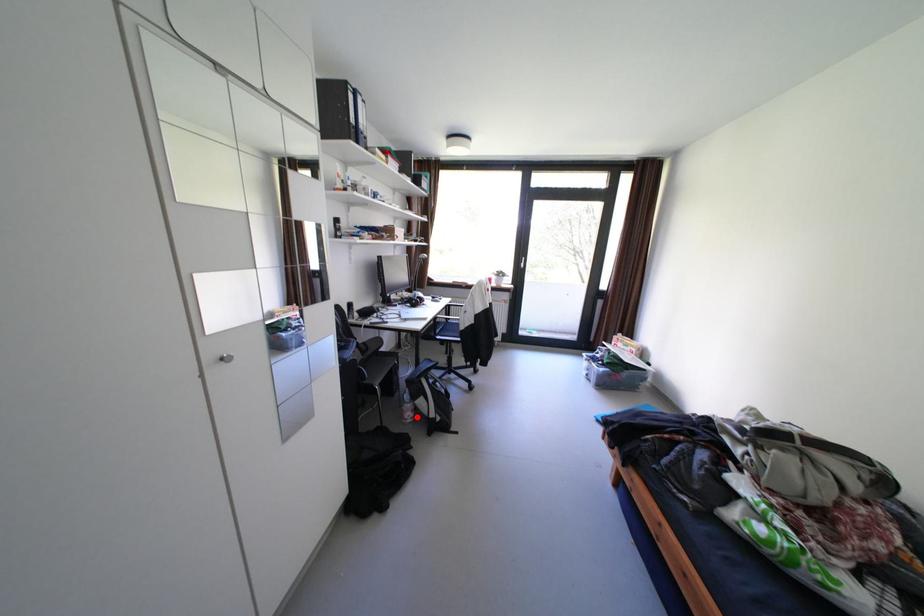
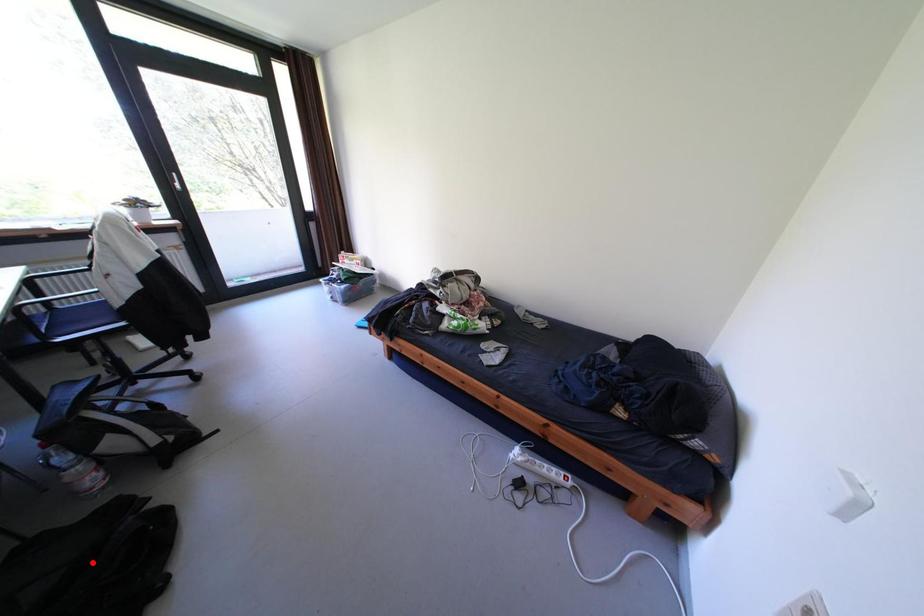
I am providing you with two images of the same scene from different viewpoints. A red point is marked on the first image and another point is marked on the second image. Is the red point in image1 aligned with the point shown in image2?

No